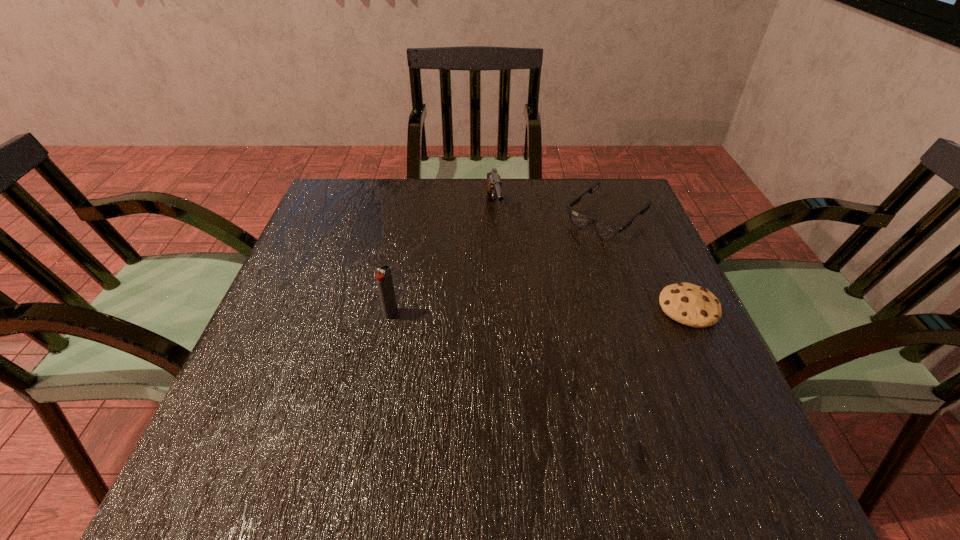
Find the location of a particular element. This screenshot has width=960, height=540. the leftmost object is located at coordinates (384, 281).

The height and width of the screenshot is (540, 960). Identify the location of the shortest object. (692, 305).

Identify the location of sunglasses. (606, 231).

Where is `the second object from left to right`? The image size is (960, 540). the second object from left to right is located at coordinates (493, 190).

Identify the location of vacant space located on the back of the leftmost object. (399, 270).

Where is `free space located on the left of the cookie`? free space located on the left of the cookie is located at coordinates (565, 308).

At what (x,y) coordinates should I click in order to perform the action: click on vacant space located on the temples of the sunglasses. Please return your answer as a coordinate pair (x, y). The height and width of the screenshot is (540, 960). Looking at the image, I should click on (560, 257).

The height and width of the screenshot is (540, 960). Identify the location of vacant space situated 0.250m on the temples of the sunglasses. (522, 289).

Where is `free location located 0.380m on the temples of the sunglasses`? free location located 0.380m on the temples of the sunglasses is located at coordinates (483, 322).

This screenshot has height=540, width=960. What are the coordinates of `free space located at the barrel of the pistol` in the screenshot? It's located at (504, 269).